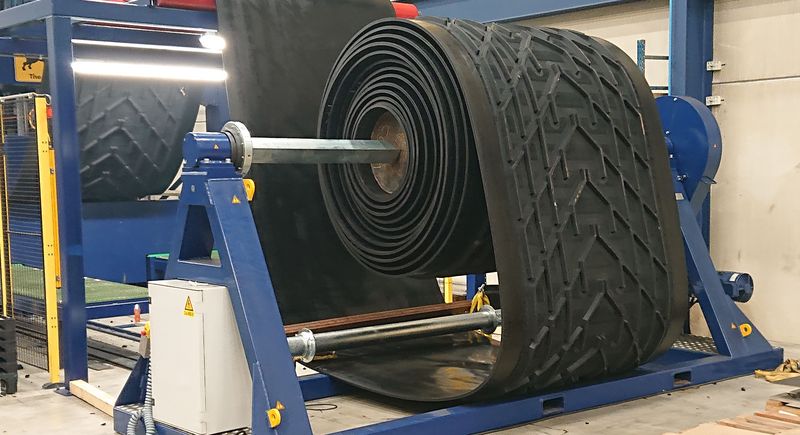
The height and width of the screenshot is (435, 800). What are the coordinates of `textured side of the mat` in the screenshot? It's located at (556, 252), (509, 87), (586, 55), (637, 215).